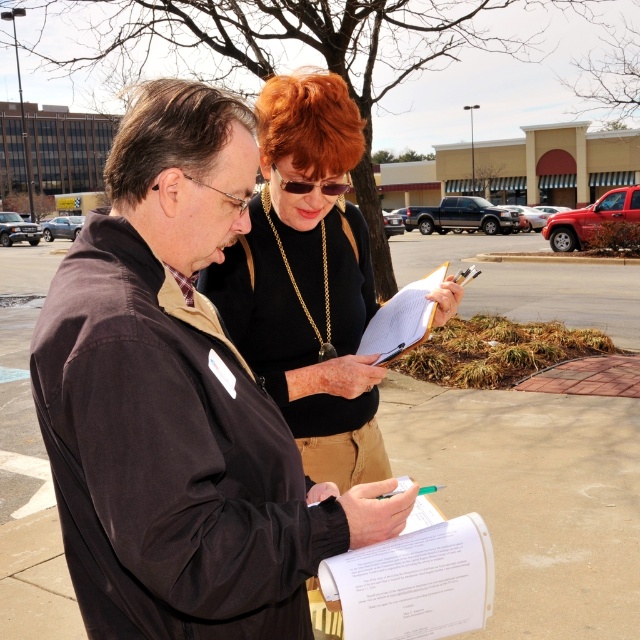
Between black matte shirt at center and white paper at center, which one appears on the right side from the viewer's perspective?

white paper at center is more to the right.

Is black matte shirt at center wider than white paper at center?

Yes, black matte shirt at center is wider than white paper at center.

At what (x,y) coordinates should I click in order to perform the action: click on black matte shirt at center. Please return your answer as a coordinate pair (x, y). This screenshot has height=640, width=640. Looking at the image, I should click on (307, 280).

Is point (115, 628) behind point (300, 268)?

No, (115, 628) is in front of (300, 268).

Which is above, dark brown jacket at center or black matte shirt at center?

black matte shirt at center is higher up.

Which is in front, point (138, 624) or point (346, 387)?

Point (138, 624)

You are a GUI agent. You are given a task and a screenshot of the screen. Output one action in this format:
    pyautogui.click(x=<x>, y=<y>)
    Task: Click on the dark brown jacket at center
    The height and width of the screenshot is (640, 640).
    Given the screenshot: What is the action you would take?
    pos(177,403)

Which is more to the right, dark brown jacket at center or white paper at center?

From the viewer's perspective, white paper at center appears more on the right side.

This screenshot has width=640, height=640. I want to click on dark brown jacket at center, so click(x=177, y=403).